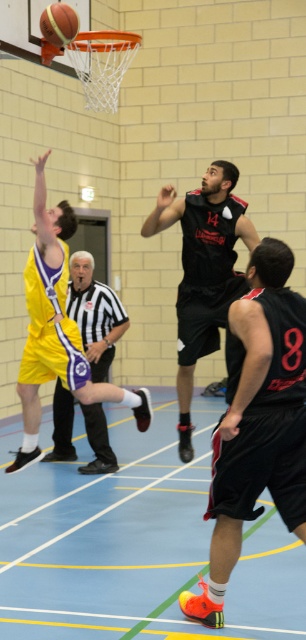
Between yellow jersey at left and black and white striped shirt at center, which one appears on the left side from the viewer's perspective?

yellow jersey at left is more to the left.

Is point (33, 308) more distant than point (97, 320)?

No.

This screenshot has height=640, width=306. In order to click on yellow jersey at left in this screenshot , I will do `click(56, 326)`.

Is black matte shorts at center below yellow jersey at left?

Yes.

Who is more distant from viewer, (243, 451) or (52, 333)?

Positioned behind is point (52, 333).

Identify the location of black matte shorts at center. (257, 420).

From the picture: Can you confirm if black and white striped shirt at center is positioned above rubber textured basketball at center?

Incorrect, black and white striped shirt at center is not positioned above rubber textured basketball at center.

Is black and white striped shirt at center to the right of rubber textured basketball at center from the viewer's perspective?

Yes, black and white striped shirt at center is to the right of rubber textured basketball at center.

Is point (104, 320) positioned after point (63, 10)?

Yes.

The height and width of the screenshot is (640, 306). I want to click on black and white striped shirt at center, so click(x=94, y=314).